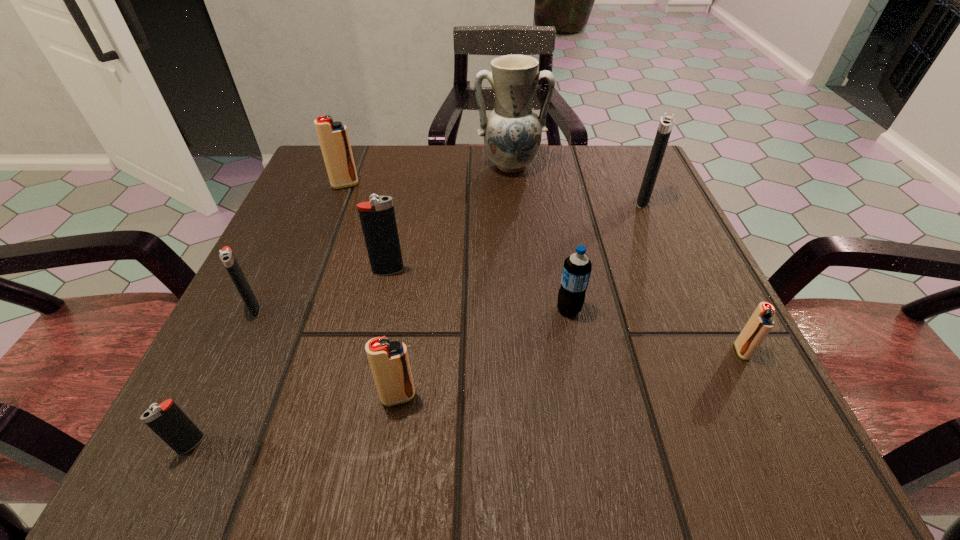
What are the coordinates of `the second nearest object` in the screenshot? It's located at (389, 361).

Image resolution: width=960 pixels, height=540 pixels. Find the location of `the nearest red igniter`. the nearest red igniter is located at coordinates (389, 361).

This screenshot has width=960, height=540. In order to click on the third nearest object in this screenshot , I will do `click(759, 325)`.

Image resolution: width=960 pixels, height=540 pixels. What are the coordinates of `the second nearest red igniter` in the screenshot? It's located at (759, 325).

Find the location of a particular element. This screenshot has width=960, height=540. the nearest object is located at coordinates (167, 420).

I want to click on the smallest black igniter, so click(167, 420).

The height and width of the screenshot is (540, 960). What are the coordinates of `vacant space situated 0.120m on either side of the tallest object` in the screenshot? It's located at (515, 215).

At what (x,y) coordinates should I click in order to perform the action: click on vacant space situated on the front of the seventh nearest object. Please return your answer as a coordinate pair (x, y). Looking at the image, I should click on (688, 300).

Locate an element on the screen. The width and height of the screenshot is (960, 540). vacant region located 0.050m on the right of the leftmost red igniter is located at coordinates (382, 185).

Locate an element on the screen. vacant area situated on the left of the fifth nearest igniter is located at coordinates (253, 271).